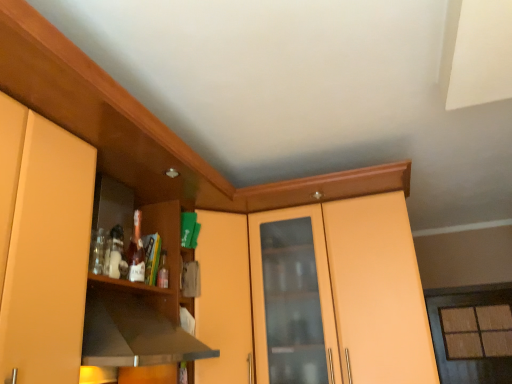
Question: Is black matte exhaust hood at left closer to camera compared to matte glass window at right?

Choices:
 (A) yes
 (B) no

Answer: (A)

Question: Considering the relative sizes of black matte exhaust hood at left and matte glass window at right in the image provided, is black matte exhaust hood at left taller than matte glass window at right?

Choices:
 (A) yes
 (B) no

Answer: (B)

Question: Is black matte exhaust hood at left at the right side of matte glass window at right?

Choices:
 (A) yes
 (B) no

Answer: (B)

Question: From a real-world perspective, is black matte exhaust hood at left physically below matte glass window at right?

Choices:
 (A) yes
 (B) no

Answer: (B)

Question: Considering the relative sizes of black matte exhaust hood at left and matte glass window at right in the image provided, is black matte exhaust hood at left shorter than matte glass window at right?

Choices:
 (A) no
 (B) yes

Answer: (B)

Question: Does black matte exhaust hood at left have a lesser width compared to matte glass window at right?

Choices:
 (A) yes
 (B) no

Answer: (B)

Question: From the image's perspective, would you say translucent glass bottle at shelf center is shown under black matte exhaust hood at left?

Choices:
 (A) no
 (B) yes

Answer: (A)

Question: Is translucent glass bottle at shelf center smaller than black matte exhaust hood at left?

Choices:
 (A) no
 (B) yes

Answer: (B)

Question: Is translucent glass bottle at shelf center not near black matte exhaust hood at left?

Choices:
 (A) no
 (B) yes

Answer: (A)

Question: From a real-world perspective, is translucent glass bottle at shelf center physically above black matte exhaust hood at left?

Choices:
 (A) yes
 (B) no

Answer: (A)

Question: Does translucent glass bottle at shelf center have a lesser height compared to black matte exhaust hood at left?

Choices:
 (A) no
 (B) yes

Answer: (B)

Question: From the image's perspective, is translucent glass bottle at shelf center over black matte exhaust hood at left?

Choices:
 (A) yes
 (B) no

Answer: (A)

Question: Is black matte exhaust hood at left a part of matte glass window at right?

Choices:
 (A) no
 (B) yes

Answer: (A)